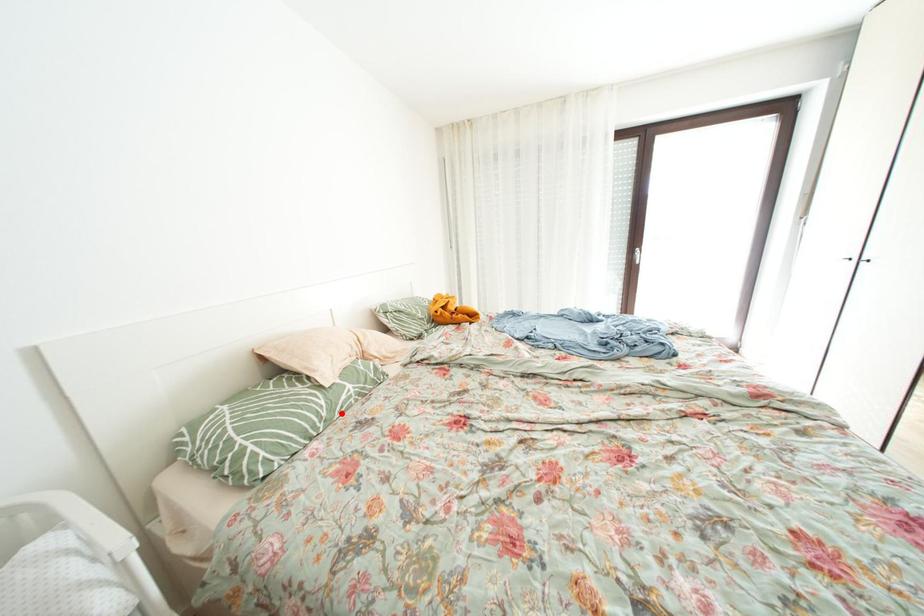
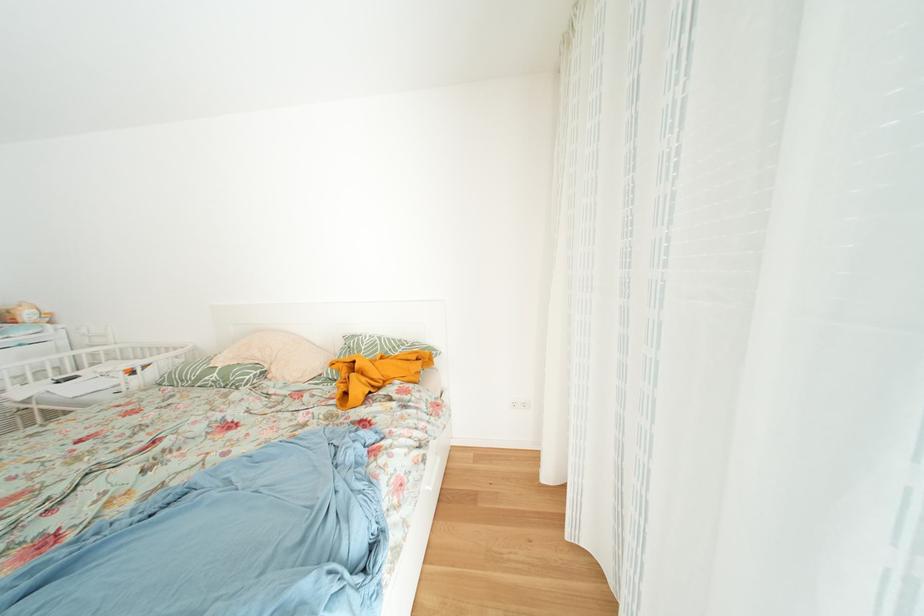
Question: I am providing you with two images of the same scene from different viewpoints. A red point is marked on the first image. Is the red point's position out of view in image 2?

Choices:
 (A) Yes
 (B) No

Answer: (B)